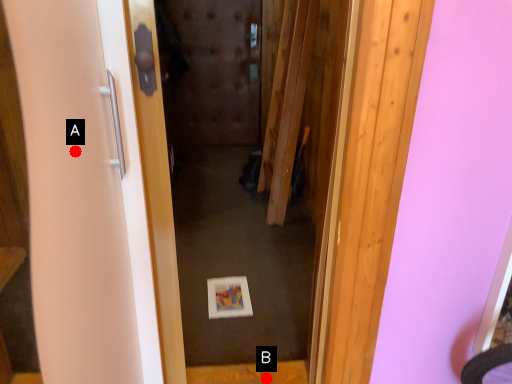
Question: Two points are circled on the image, labeled by A and B beside each circle. Which point appears farthest from the camera in this image?

Choices:
 (A) A is further
 (B) B is further

Answer: (B)